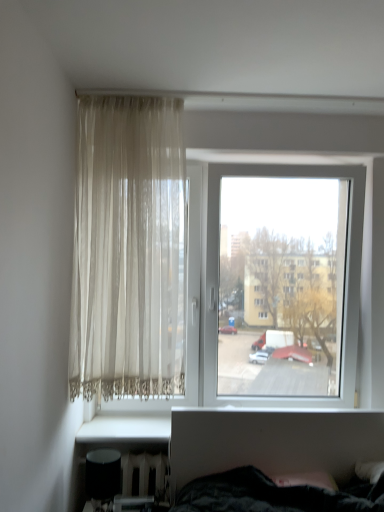
Describe the element at coordinates (128, 250) in the screenshot. I see `sheer beige curtain at upper left` at that location.

This screenshot has height=512, width=384. Find the location of `sheer beige curtain at upper left`. sheer beige curtain at upper left is located at coordinates (128, 250).

Consider the image. In order to face sheer beige curtain at upper left, should I rotate leftwards or rightwards?

Rotate your view left by about 7.404°.

In order to click on transparent glass window at center in this screenshot , I will do `click(198, 269)`.

What do you see at coordinates (198, 269) in the screenshot? The width and height of the screenshot is (384, 512). I see `transparent glass window at center` at bounding box center [198, 269].

Identify the location of sheer beige curtain at upper left. (128, 250).

Which is more to the right, sheer beige curtain at upper left or transparent glass window at center?

transparent glass window at center.

Relative to transparent glass window at center, is sheer beige curtain at upper left in front or behind?

Clearly, sheer beige curtain at upper left is in front of transparent glass window at center.

Is point (142, 236) closer or farther from the camera than point (146, 233)?

Point (142, 236) is positioned closer to the camera compared to point (146, 233).

From the image's perspective, is sheer beige curtain at upper left below transparent glass window at center?

No, from the image's perspective, sheer beige curtain at upper left is not below transparent glass window at center.

From a real-world perspective, is sheer beige curtain at upper left physically below transparent glass window at center?

Actually, sheer beige curtain at upper left is physically above transparent glass window at center in the real world.

Considering the sizes of objects sheer beige curtain at upper left and transparent glass window at center in the image provided, who is thinner, sheer beige curtain at upper left or transparent glass window at center?

With smaller width is sheer beige curtain at upper left.

Is sheer beige curtain at upper left taller or shorter than transparent glass window at center?

sheer beige curtain at upper left is taller than transparent glass window at center.

Does sheer beige curtain at upper left have a smaller size compared to transparent glass window at center?

Yes.

Is sheer beige curtain at upper left inside or outside of transparent glass window at center?

sheer beige curtain at upper left is not inside transparent glass window at center, it's outside.

Is sheer beige curtain at upper left beside transparent glass window at center?

No, sheer beige curtain at upper left is not next to transparent glass window at center.

Does sheer beige curtain at upper left turn towards transparent glass window at center?

No, sheer beige curtain at upper left does not turn towards transparent glass window at center.

Can you tell me how much sheer beige curtain at upper left and transparent glass window at center differ in facing direction?

1.52 degrees.

How much distance is there between sheer beige curtain at upper left and transparent glass window at center?

They are 13.28 inches apart.

Where is `window lying below the sheer beige curtain at upper left (from the image's perspective)`? This screenshot has height=512, width=384. window lying below the sheer beige curtain at upper left (from the image's perspective) is located at coordinates (198, 269).

Between transparent glass window at center and sheer beige curtain at upper left, which one appears on the right side from the viewer's perspective?

From the viewer's perspective, transparent glass window at center appears more on the right side.

Is transparent glass window at center positioned in front of sheer beige curtain at upper left?

No.

Is point (107, 303) less distant than point (85, 266)?

No, (107, 303) is further to viewer.

From the image's perspective, does transparent glass window at center appear higher than sheer beige curtain at upper left?

No.

From a real-world perspective, which is physically below, transparent glass window at center or sheer beige curtain at upper left?

transparent glass window at center is physically lower.

In terms of width, does transparent glass window at center look wider or thinner when compared to sheer beige curtain at upper left?

Considering their sizes, transparent glass window at center looks broader than sheer beige curtain at upper left.

Does transparent glass window at center have a lesser height compared to sheer beige curtain at upper left?

Yes, transparent glass window at center is shorter than sheer beige curtain at upper left.

Is transparent glass window at center bigger or smaller than sheer beige curtain at upper left?

In the image, transparent glass window at center appears to be larger than sheer beige curtain at upper left.

Choose the correct answer: Is transparent glass window at center inside sheer beige curtain at upper left or outside it?

transparent glass window at center cannot be found inside sheer beige curtain at upper left.

Are transparent glass window at center and sheer beige curtain at upper left far apart?

No.

Is sheer beige curtain at upper left at the back of transparent glass window at center?

Yes, transparent glass window at center is facing away from sheer beige curtain at upper left.

This screenshot has width=384, height=512. In order to click on window lying on the right of sheer beige curtain at upper left in this screenshot , I will do `click(198, 269)`.

I want to click on window behind the sheer beige curtain at upper left, so click(198, 269).

This screenshot has height=512, width=384. In the image, there is a sheer beige curtain at upper left. In order to click on window below it (from the image's perspective) in this screenshot , I will do `click(198, 269)`.